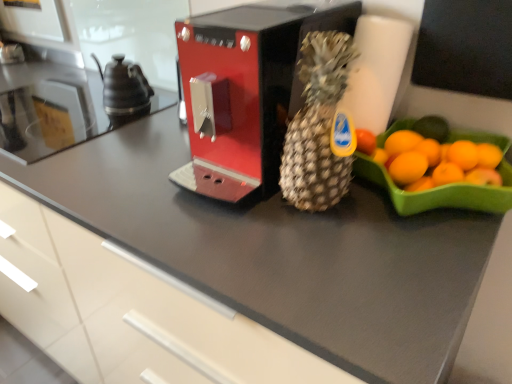
Identify the location of satin black countertop at left. Image resolution: width=512 pixels, height=384 pixels. (49, 109).

The height and width of the screenshot is (384, 512). I want to click on brown textured pineapple at center, so click(x=317, y=125).

You are a GUI agent. You are given a task and a screenshot of the screen. Output one action in this format:
    pyautogui.click(x=<x>, y=<y>)
    Task: Click on the satin black countertop at left
    This screenshot has height=384, width=512.
    Given the screenshot: What is the action you would take?
    pyautogui.click(x=49, y=109)

Which is more to the right, metallic red coffee machine at center or satin black countertop at left?

Positioned to the right is metallic red coffee machine at center.

From the image's perspective, between metallic red coffee machine at center and satin black countertop at left, which one is located above?

satin black countertop at left.

Between metallic red coffee machine at center and satin black countertop at left, which one has larger size?

Bigger between the two is metallic red coffee machine at center.

Considering the points (177, 182) and (62, 129), which point is behind, point (177, 182) or point (62, 129)?

The point (62, 129) is farther from the camera.

Based on the photo, from a real-world perspective, is brown textured pineapple at center on top of satin black countertop at left?

Yes, from a real-world perspective, brown textured pineapple at center is over satin black countertop at left

Does point (319, 182) appear closer or farther from the camera than point (102, 115)?

Point (319, 182) appears to be closer to the viewer than point (102, 115).

Consider the image. Considering the relative sizes of brown textured pineapple at center and satin black countertop at left in the image provided, is brown textured pineapple at center taller than satin black countertop at left?

Indeed, brown textured pineapple at center has a greater height compared to satin black countertop at left.

Is satin black countertop at left at the back of brown textured pineapple at center?

No, brown textured pineapple at center is not facing the opposite direction of satin black countertop at left.

Is black ceramic tea pot at left at the back of metallic red coffee machine at center?

metallic red coffee machine at center does not have its back to black ceramic tea pot at left.

You are a GUI agent. You are given a task and a screenshot of the screen. Output one action in this format:
    pyautogui.click(x=<x>, y=<y>)
    Task: Click on the kitchen appliance that is on the right side of black ceramic tea pot at left
    The width and height of the screenshot is (512, 384).
    Given the screenshot: What is the action you would take?
    pyautogui.click(x=247, y=90)

Would you say metallic red coffee machine at center is outside black ceramic tea pot at left?

Absolutely, metallic red coffee machine at center is external to black ceramic tea pot at left.

There is a metallic red coffee machine at center. Where is `pineapple above it (from a real-world perspective)`? The height and width of the screenshot is (384, 512). pineapple above it (from a real-world perspective) is located at coordinates (317, 125).

How different are the orientations of metallic red coffee machine at center and brown textured pineapple at center in degrees?

There is a 0.00173-degree angle between the facing directions of metallic red coffee machine at center and brown textured pineapple at center.

Is metallic red coffee machine at center thinner than brown textured pineapple at center?

No.

From the image's perspective, which is above, metallic red coffee machine at center or brown textured pineapple at center?

metallic red coffee machine at center, from the image's perspective.

Which of these two, satin black countertop at left or metallic red coffee machine at center, is smaller?

satin black countertop at left is smaller.

In the scene shown: Is satin black countertop at left spatially inside metallic red coffee machine at center, or outside of it?

satin black countertop at left exists outside the volume of metallic red coffee machine at center.

Between satin black countertop at left and metallic red coffee machine at center, which one is positioned behind?

satin black countertop at left is more distant.

Measure the distance between satin black countertop at left and metallic red coffee machine at center.

satin black countertop at left is 17.73 inches from metallic red coffee machine at center.

Which of these two, satin black countertop at left or black ceramic tea pot at left, is smaller?

black ceramic tea pot at left is smaller.

Is satin black countertop at left positioned far away from black ceramic tea pot at left?

They are positioned close to each other.

Looking at this image, from a real-world perspective, is satin black countertop at left physically located above or below black ceramic tea pot at left?

From a real-world perspective, satin black countertop at left is physically below black ceramic tea pot at left.

Considering the positions of points (67, 81) and (126, 104), is point (67, 81) farther from camera compared to point (126, 104)?

Yes, point (67, 81) is farther from viewer.

Would you say brown textured pineapple at center is inside or outside metallic red coffee machine at center?

brown textured pineapple at center is spatially situated outside metallic red coffee machine at center.

Looking at this image, from their relative heights in the image, would you say brown textured pineapple at center is taller or shorter than metallic red coffee machine at center?

brown textured pineapple at center is taller than metallic red coffee machine at center.

Is point (297, 187) more distant than point (239, 135)?

No, it is in front of (239, 135).

Looking at the image, does brown textured pineapple at center seem bigger or smaller compared to metallic red coffee machine at center?

In the image, brown textured pineapple at center appears to be smaller than metallic red coffee machine at center.

What are the coordinates of `countertop that is above the metallic red coffee machine at center (from the image's perspective)` in the screenshot? It's located at (49, 109).

Locate an element on the screen. This screenshot has width=512, height=384. pineapple on the right side of satin black countertop at left is located at coordinates (317, 125).

Based on their spatial positions, is satin black countertop at left or metallic red coffee machine at center further from black ceramic tea pot at left?

Based on the image, metallic red coffee machine at center appears to be further to black ceramic tea pot at left.

Which object lies nearer to the anchor point satin black countertop at left, brown textured pineapple at center or metallic red coffee machine at center?

metallic red coffee machine at center.

When comparing their distances from metallic red coffee machine at center, does black ceramic tea pot at left or brown textured pineapple at center seem further?

Based on the image, black ceramic tea pot at left appears to be further to metallic red coffee machine at center.

From the image, which object appears to be nearer to satin black countertop at left, black ceramic tea pot at left or brown textured pineapple at center?

The object closer to satin black countertop at left is black ceramic tea pot at left.

Based on their spatial positions, is black ceramic tea pot at left or metallic red coffee machine at center further from brown textured pineapple at center?

Based on the image, black ceramic tea pot at left appears to be further to brown textured pineapple at center.

Which object lies nearer to the anchor point metallic red coffee machine at center, brown textured pineapple at center or black ceramic tea pot at left?

The object closer to metallic red coffee machine at center is brown textured pineapple at center.

Which object lies further to the anchor point brown textured pineapple at center, black ceramic tea pot at left or satin black countertop at left?

satin black countertop at left lies further to brown textured pineapple at center than the other object.

From the image, which object appears to be farther from metallic red coffee machine at center, satin black countertop at left or brown textured pineapple at center?

The object further to metallic red coffee machine at center is satin black countertop at left.

You are a GUI agent. You are given a task and a screenshot of the screen. Output one action in this format:
    pyautogui.click(x=<x>, y=<y>)
    Task: Click on the kitchen appliance located between brown textured pineapple at center and black ceramic tea pot at left in the depth direction
    
    Given the screenshot: What is the action you would take?
    pyautogui.click(x=247, y=90)

The image size is (512, 384). In order to click on kitchen appliance between satin black countertop at left and brown textured pineapple at center from left to right in this screenshot , I will do `click(247, 90)`.

You are a GUI agent. You are given a task and a screenshot of the screen. Output one action in this format:
    pyautogui.click(x=<x>, y=<y>)
    Task: Click on the tea pot located between satin black countertop at left and metallic red coffee machine at center in the left-right direction
    
    Given the screenshot: What is the action you would take?
    pyautogui.click(x=124, y=88)

Locate an element on the screen. The height and width of the screenshot is (384, 512). tea pot between satin black countertop at left and brown textured pineapple at center in the horizontal direction is located at coordinates (124, 88).